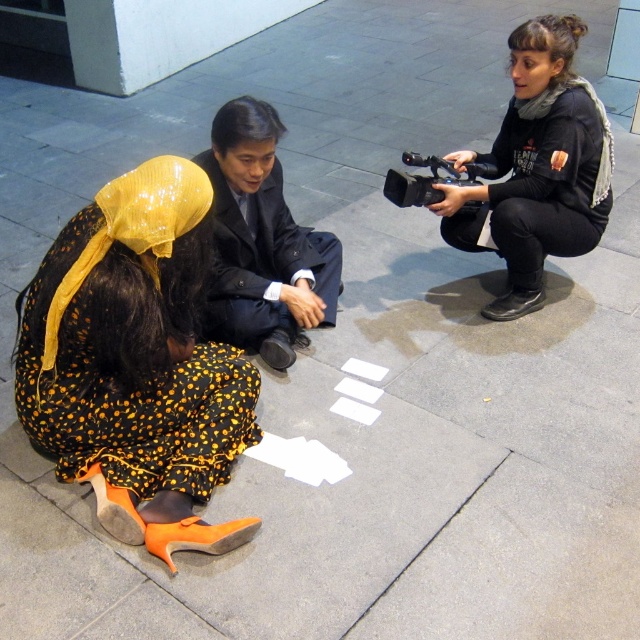
Who is higher up, orange fabric dress at lower left or black glossy suit at center?

black glossy suit at center

Is point (204, 262) closer to viewer compared to point (273, 147)?

Yes, it is in front of point (273, 147).

At what (x,y) coordinates should I click in order to perform the action: click on orange fabric dress at lower left. Please return your answer as a coordinate pair (x, y). The image size is (640, 640). Looking at the image, I should click on (136, 362).

At what (x,y) coordinates should I click in order to perform the action: click on orange fabric dress at lower left. Please return your answer as a coordinate pair (x, y). Looking at the image, I should click on (136, 362).

Which of these two, orange fabric dress at lower left or black matte camera at center, stands taller?

Standing taller between the two is black matte camera at center.

Does orange fabric dress at lower left have a larger size compared to black matte camera at center?

Actually, orange fabric dress at lower left might be smaller than black matte camera at center.

Who is more distant from viewer, (163, 394) or (541, 104)?

Positioned behind is point (541, 104).

I want to click on orange fabric dress at lower left, so point(136,362).

Is point (529, 163) less distant than point (273, 204)?

No, it is behind (273, 204).

Can you confirm if black matte camera at center is wider than black glossy suit at center?

Indeed, black matte camera at center has a greater width compared to black glossy suit at center.

Who is more forward, (x=538, y=291) or (x=218, y=312)?

Point (x=218, y=312) is more forward.

I want to click on black matte camera at center, so click(538, 168).